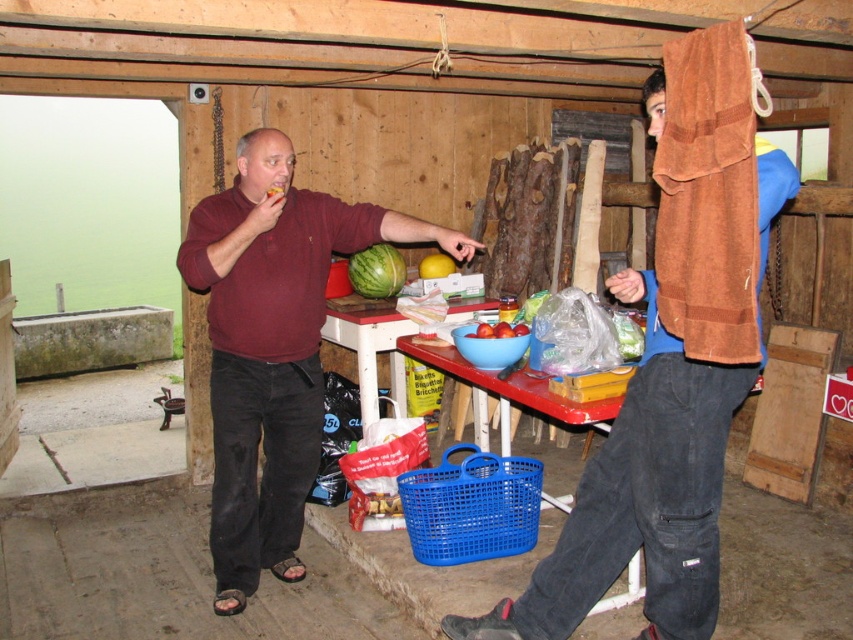
Question: Which point appears farthest from the camera in this image?

Choices:
 (A) coord(265,236)
 (B) coord(364,408)

Answer: (B)

Question: Observing the image, what is the correct spatial positioning of brown suede jacket at upper right in reference to green matte watermelon at center?

Choices:
 (A) right
 (B) left

Answer: (A)

Question: Considering the relative positions of brown suede jacket at upper right and smooth red apples at center in the image provided, where is brown suede jacket at upper right located with respect to smooth red apples at center?

Choices:
 (A) right
 (B) left

Answer: (A)

Question: Can you confirm if green matte watermelon at center is positioned to the left of smooth red apples at center?

Choices:
 (A) no
 (B) yes

Answer: (B)

Question: Which point is closer to the camera?

Choices:
 (A) smooth red apples at center
 (B) wooden table at center
 (C) brown suede jacket at upper right

Answer: (C)

Question: Among these objects, which one is farthest from the camera?

Choices:
 (A) yellow matte lemon at center
 (B) green matte watermelon at center

Answer: (A)